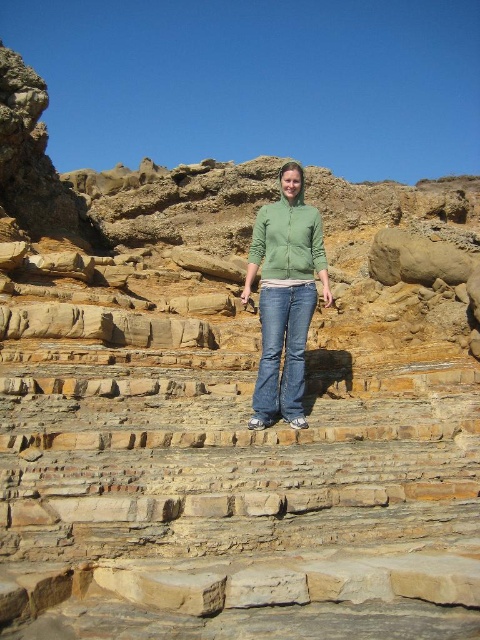
Can you confirm if green matte hoodie at center is smaller than blue denim jeans at center?

Incorrect, green matte hoodie at center is not smaller in size than blue denim jeans at center.

Is green matte hoodie at center positioned behind blue denim jeans at center?

Yes, green matte hoodie at center is further from the viewer.

Is point (321, 256) positioned after point (277, 333)?

Yes.

Identify the location of green matte hoodie at center. (285, 296).